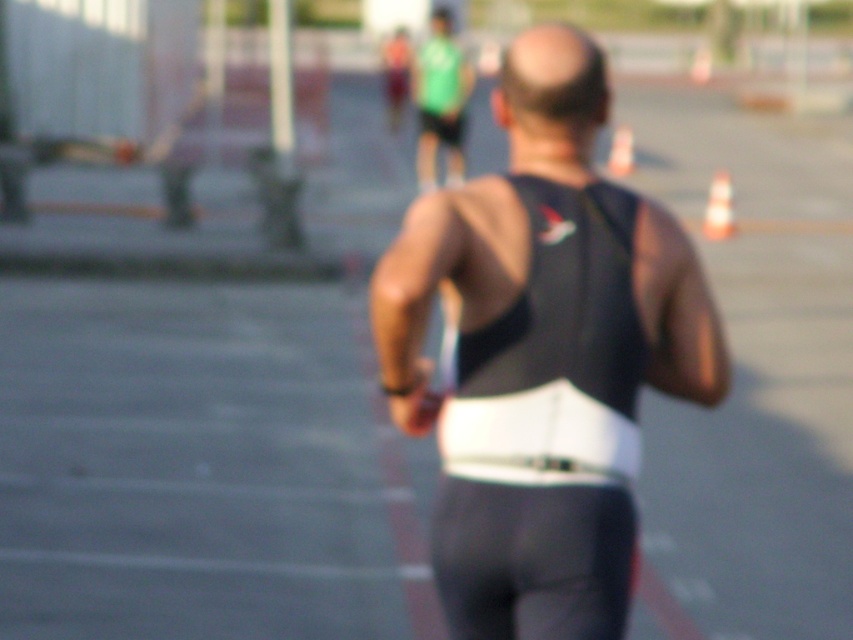
You are a photographer at the sports event and want to capture a photo of the black matte triathlon suit at center and the black matte vest at center. Based on their positions, which one is wider?

The black matte triathlon suit at center is wider than the black matte vest at center according to the description.

You are a photographer at the sports event. You want to take a photo of the participant in the black matte triathlon suit at center. Where should you focus your camera to capture the point at coordinate (546,262) on their suit?

The point at coordinate (546,262) is located on the black matte triathlon suit at center, so you should focus your camera on the black matte triathlon suit at center to capture that point.